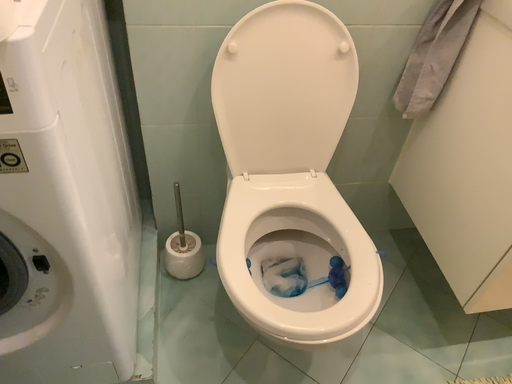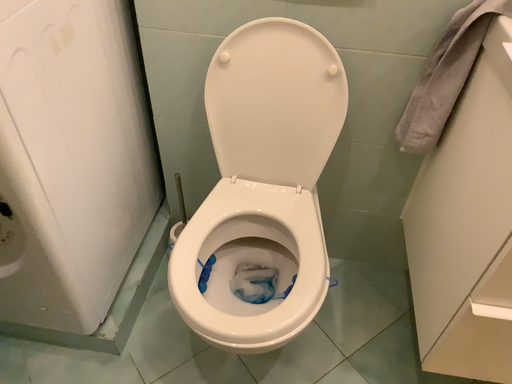
Question: Which way did the camera rotate in the video?

Choices:
 (A) rotated left
 (B) rotated right

Answer: (A)